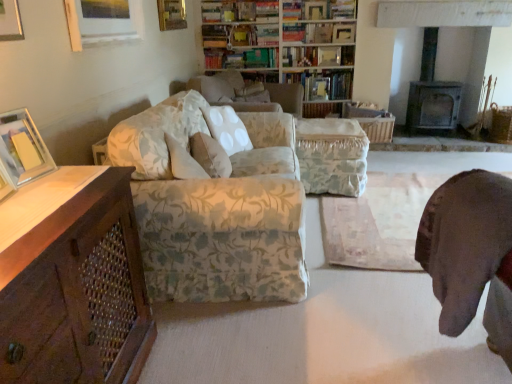
You are a GUI agent. You are given a task and a screenshot of the screen. Output one action in this format:
    pyautogui.click(x=<x>, y=<y>)
    Task: Click on the vacant space to the right of matte glass picture frame at upper left, the second picture frame in the left-to-right sequence
    The height and width of the screenshot is (384, 512).
    Given the screenshot: What is the action you would take?
    pyautogui.click(x=73, y=182)